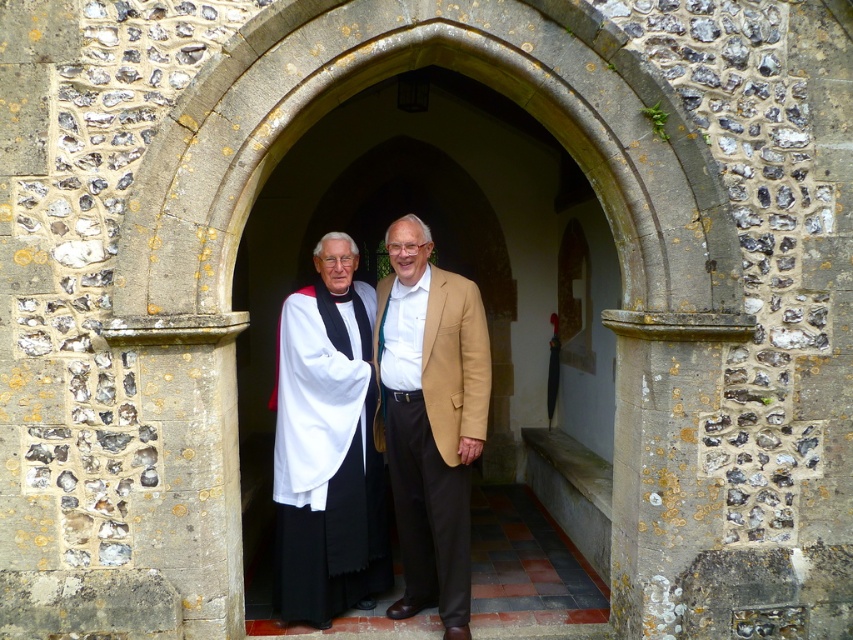
You are a photographer trying to capture both the white cloth at center and the matte white robe at center in the same frame. Given their height difference, which object should you focus on first to ensure both are fully visible in your shot?

The white cloth at center is much taller than the matte white robe at center. To ensure both are fully visible, focus on the white cloth at center first, then adjust the framing to include the shorter matte white robe at center.